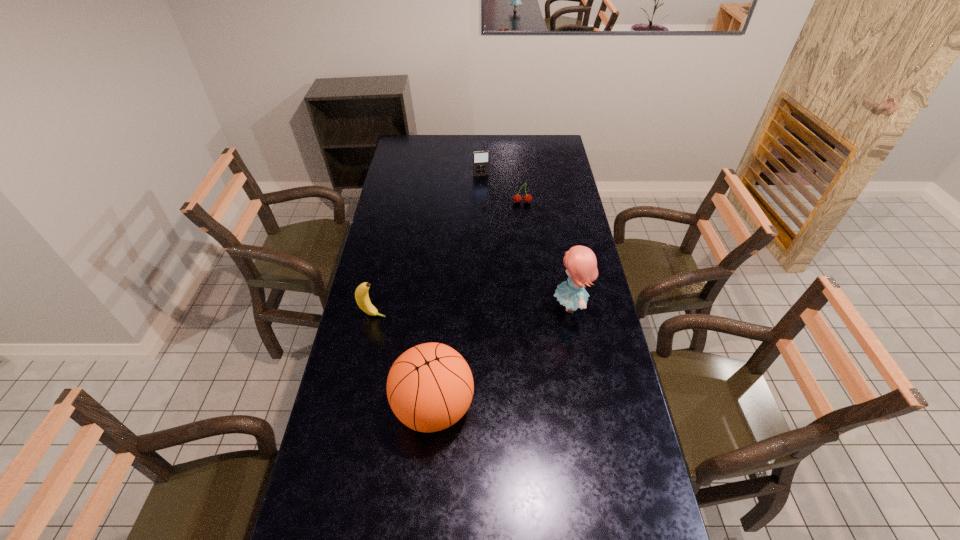
Where is `free spot that satisfies the following two spatial constraints: 1. on the back side of the doll; 2. on the front-facing side of the leftmost object`? The image size is (960, 540). free spot that satisfies the following two spatial constraints: 1. on the back side of the doll; 2. on the front-facing side of the leftmost object is located at coordinates (375, 306).